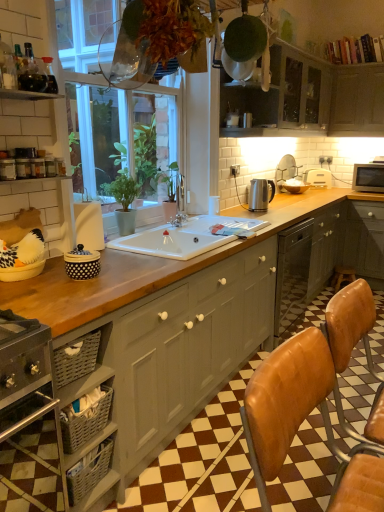
Identify the location of empty space that is ontop of white ceramic sink at center (from a real-world perspective). The height and width of the screenshot is (512, 384). (218, 227).